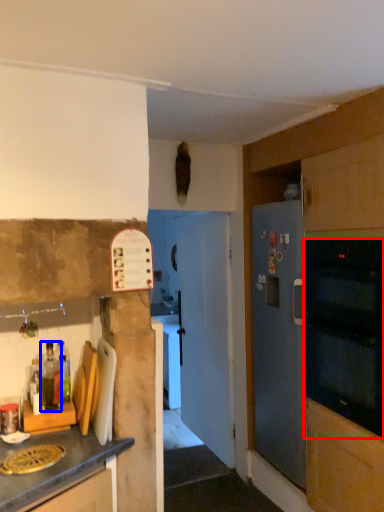
Question: Which object appears farthest to the camera in this image, oven (highlighted by a red box) or bottle (highlighted by a blue box)?

Choices:
 (A) oven
 (B) bottle

Answer: (B)